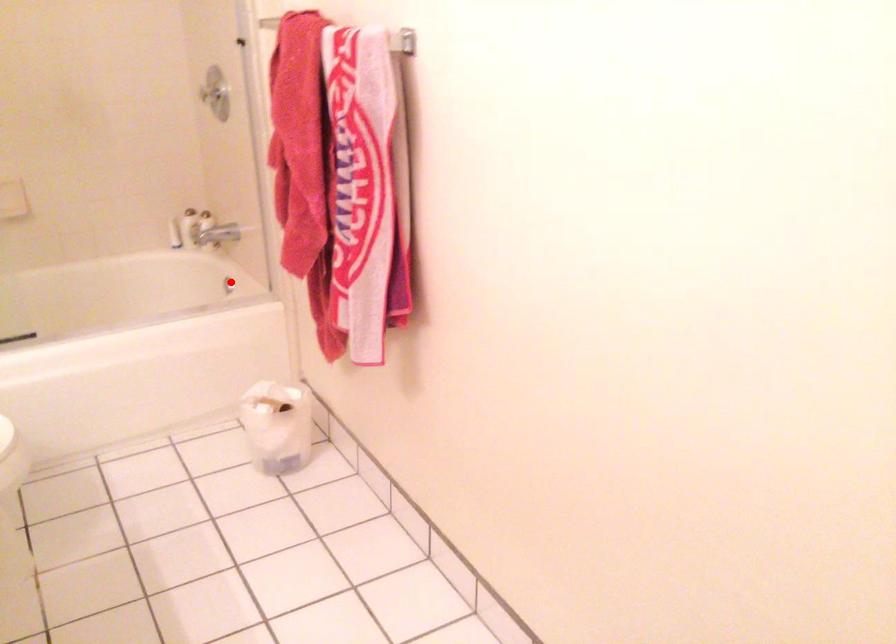
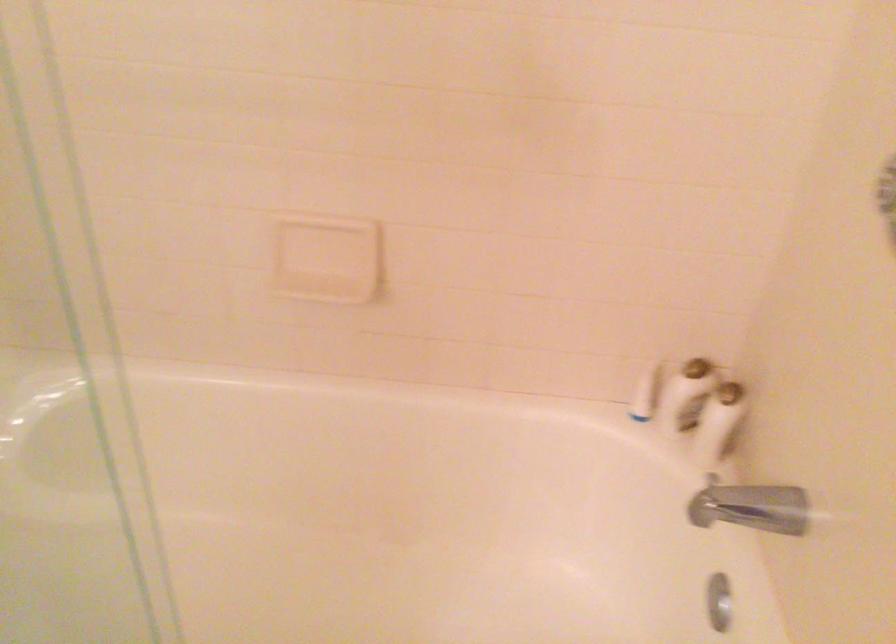
Question: A red point is marked in image1. In image2, is the corresponding 3D point closer to the camera or farther? Reply with the corresponding letter.

Choices:
 (A) The corresponding 3D point is closer.
 (B) The corresponding 3D point is farther.

Answer: (A)